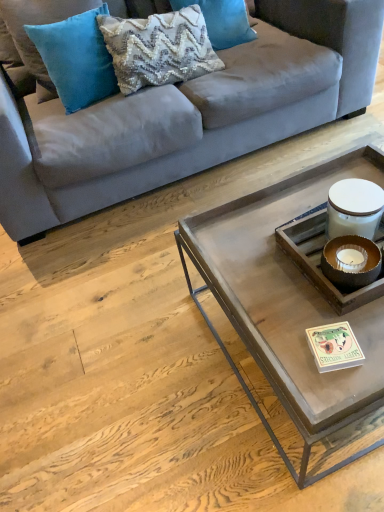
Where is `metallic gray tray at center`? The width and height of the screenshot is (384, 512). metallic gray tray at center is located at coordinates (288, 302).

What is the approximate width of woven fabric pillow at upper center, the 3th pillow viewed from the left?

12.46 inches.

The image size is (384, 512). What do you see at coordinates (159, 48) in the screenshot?
I see `textured cream pillow at upper center, the 2th pillow positioned from the left` at bounding box center [159, 48].

This screenshot has height=512, width=384. What do you see at coordinates (76, 59) in the screenshot? I see `teal velvet pillow at upper left, which is the 1th pillow from left to right` at bounding box center [76, 59].

Locate an element on the screen. The height and width of the screenshot is (512, 384). metallic gray tray at center is located at coordinates (288, 302).

You are a GUI agent. You are given a task and a screenshot of the screen. Output one action in this format:
    pyautogui.click(x=<x>, y=<y>)
    Task: Click on the coffee table below the suede gray couch at upper center (from a real-world perspective)
    This screenshot has width=384, height=512.
    Given the screenshot: What is the action you would take?
    pyautogui.click(x=288, y=302)

From the image's perspective, is suede gray couch at upper center on metallic gray tray at center?

Yes, from the image's perspective, suede gray couch at upper center is on top of metallic gray tray at center.

Is metallic gray tray at center inside suede gray couch at upper center?

No, metallic gray tray at center is located outside of suede gray couch at upper center.

Which of these two, metallic gray tray at center or teal velvet pillow at upper left, arranged as the 3th pillow when viewed from the right, stands shorter?

Standing shorter between the two is metallic gray tray at center.

Is metallic gray tray at center bigger or smaller than teal velvet pillow at upper left, arranged as the 3th pillow when viewed from the right?

Clearly, metallic gray tray at center is larger in size than teal velvet pillow at upper left, arranged as the 3th pillow when viewed from the right.

This screenshot has height=512, width=384. I want to click on coffee table on the right of teal velvet pillow at upper left, arranged as the 3th pillow when viewed from the right, so click(288, 302).

Are metallic gray tray at center and teal velvet pillow at upper left, which is the 1th pillow from left to right, located far from each other?

Yes, metallic gray tray at center is far from teal velvet pillow at upper left, which is the 1th pillow from left to right.

Is suede gray couch at upper center taller than woven fabric pillow at upper center, the first pillow in the right-to-left sequence?

Indeed, suede gray couch at upper center has a greater height compared to woven fabric pillow at upper center, the first pillow in the right-to-left sequence.

Is suede gray couch at upper center not close to woven fabric pillow at upper center, the first pillow in the right-to-left sequence?

No, suede gray couch at upper center is in close proximity to woven fabric pillow at upper center, the first pillow in the right-to-left sequence.

Does suede gray couch at upper center appear on the left side of woven fabric pillow at upper center, the 3th pillow viewed from the left?

Correct, you'll find suede gray couch at upper center to the left of woven fabric pillow at upper center, the 3th pillow viewed from the left.

In terms of height, does textured cream pillow at upper center, which is the second pillow from right to left, look taller or shorter compared to teal velvet pillow at upper left, which is the 1th pillow from left to right?

In the image, textured cream pillow at upper center, which is the second pillow from right to left, appears to be shorter than teal velvet pillow at upper left, which is the 1th pillow from left to right.

Are textured cream pillow at upper center, which is the second pillow from right to left, and teal velvet pillow at upper left, arranged as the 3th pillow when viewed from the right, beside each other?

textured cream pillow at upper center, which is the second pillow from right to left, is not next to teal velvet pillow at upper left, arranged as the 3th pillow when viewed from the right, and they're not touching.

At what (x,y) coordinates should I click in order to perform the action: click on the 1st pillow to the right when counting from the teal velvet pillow at upper left, arranged as the 3th pillow when viewed from the right. Please return your answer as a coordinate pair (x, y). Looking at the image, I should click on (159, 48).

Based on the photo, considering the relative sizes of textured cream pillow at upper center, which is the second pillow from right to left, and teal velvet pillow at upper left, which is the 1th pillow from left to right, in the image provided, is textured cream pillow at upper center, which is the second pillow from right to left, wider than teal velvet pillow at upper left, which is the 1th pillow from left to right,?

Yes, textured cream pillow at upper center, which is the second pillow from right to left, is wider than teal velvet pillow at upper left, which is the 1th pillow from left to right.

From a real-world perspective, which is physically above, metallic gray tray at center or suede gray couch at upper center?

From a 3D spatial view, suede gray couch at upper center is above.

Is metallic gray tray at center positioned behind suede gray couch at upper center?

No, metallic gray tray at center is closer to the camera.

Which object is positioned more to the left, metallic gray tray at center or suede gray couch at upper center?

suede gray couch at upper center.

Which object is positioned more to the right, woven fabric pillow at upper center, the 3th pillow viewed from the left, or textured cream pillow at upper center, the 2th pillow positioned from the left?

woven fabric pillow at upper center, the 3th pillow viewed from the left.

In terms of size, does woven fabric pillow at upper center, the 3th pillow viewed from the left, appear bigger or smaller than textured cream pillow at upper center, the 2th pillow positioned from the left?

woven fabric pillow at upper center, the 3th pillow viewed from the left, is smaller than textured cream pillow at upper center, the 2th pillow positioned from the left.

Based on the photo, is woven fabric pillow at upper center, the first pillow in the right-to-left sequence, oriented away from textured cream pillow at upper center, the 2th pillow positioned from the left?

woven fabric pillow at upper center, the first pillow in the right-to-left sequence, does not have its back to textured cream pillow at upper center, the 2th pillow positioned from the left.

From the image's perspective, which is above, woven fabric pillow at upper center, the 3th pillow viewed from the left, or textured cream pillow at upper center, the 2th pillow positioned from the left?

woven fabric pillow at upper center, the 3th pillow viewed from the left, is shown above in the image.

Could you tell me if teal velvet pillow at upper left, which is the 1th pillow from left to right, is turned towards textured cream pillow at upper center, the 2th pillow positioned from the left?

No, teal velvet pillow at upper left, which is the 1th pillow from left to right, is not turned towards textured cream pillow at upper center, the 2th pillow positioned from the left.

From the image's perspective, is teal velvet pillow at upper left, arranged as the 3th pillow when viewed from the right, above or below textured cream pillow at upper center, which is the second pillow from right to left?

teal velvet pillow at upper left, arranged as the 3th pillow when viewed from the right, is situated higher than textured cream pillow at upper center, which is the second pillow from right to left, in the image.

Is textured cream pillow at upper center, which is the second pillow from right to left, a part of teal velvet pillow at upper left, which is the 1th pillow from left to right?

No, textured cream pillow at upper center, which is the second pillow from right to left, is located outside of teal velvet pillow at upper left, which is the 1th pillow from left to right.

You are a GUI agent. You are given a task and a screenshot of the screen. Output one action in this format:
    pyautogui.click(x=<x>, y=<y>)
    Task: Click on the coffee table below the suede gray couch at upper center (from the image's perspective)
    This screenshot has width=384, height=512.
    Given the screenshot: What is the action you would take?
    pyautogui.click(x=288, y=302)

Locate an element on the screen. The height and width of the screenshot is (512, 384). coffee table on the right of teal velvet pillow at upper left, which is the 1th pillow from left to right is located at coordinates (288, 302).

Looking at the image, which one is located closer to teal velvet pillow at upper left, which is the 1th pillow from left to right, textured cream pillow at upper center, which is the second pillow from right to left, or metallic gray tray at center?

textured cream pillow at upper center, which is the second pillow from right to left, is positioned closer to the anchor teal velvet pillow at upper left, which is the 1th pillow from left to right.

When comparing their distances from woven fabric pillow at upper center, the 3th pillow viewed from the left, does metallic gray tray at center or textured cream pillow at upper center, which is the second pillow from right to left, seem closer?

textured cream pillow at upper center, which is the second pillow from right to left.

Which object lies further to the anchor point metallic gray tray at center, textured cream pillow at upper center, the 2th pillow positioned from the left, or suede gray couch at upper center?

The object further to metallic gray tray at center is textured cream pillow at upper center, the 2th pillow positioned from the left.

Estimate the real-world distances between objects in this image. Which object is further from teal velvet pillow at upper left, arranged as the 3th pillow when viewed from the right, metallic gray tray at center or woven fabric pillow at upper center, the 3th pillow viewed from the left?

The object further to teal velvet pillow at upper left, arranged as the 3th pillow when viewed from the right, is metallic gray tray at center.

Which object lies further to the anchor point metallic gray tray at center, suede gray couch at upper center or teal velvet pillow at upper left, arranged as the 3th pillow when viewed from the right?

The object further to metallic gray tray at center is teal velvet pillow at upper left, arranged as the 3th pillow when viewed from the right.

Considering their positions, is woven fabric pillow at upper center, the first pillow in the right-to-left sequence, positioned further to textured cream pillow at upper center, the 2th pillow positioned from the left, than suede gray couch at upper center?

suede gray couch at upper center is further to textured cream pillow at upper center, the 2th pillow positioned from the left.

Based on their spatial positions, is textured cream pillow at upper center, which is the second pillow from right to left, or woven fabric pillow at upper center, the 3th pillow viewed from the left, further from suede gray couch at upper center?

Among the two, woven fabric pillow at upper center, the 3th pillow viewed from the left, is located further to suede gray couch at upper center.

Which object lies nearer to the anchor point metallic gray tray at center, teal velvet pillow at upper left, arranged as the 3th pillow when viewed from the right, or textured cream pillow at upper center, which is the second pillow from right to left?

textured cream pillow at upper center, which is the second pillow from right to left.

At what (x,y) coordinates should I click in order to perform the action: click on pillow between suede gray couch at upper center and metallic gray tray at center in the up-down direction. Please return your answer as a coordinate pair (x, y). The height and width of the screenshot is (512, 384). Looking at the image, I should click on (159, 48).

This screenshot has height=512, width=384. In order to click on studio couch that lies between woven fabric pillow at upper center, the first pillow in the right-to-left sequence, and metallic gray tray at center from top to bottom in this screenshot , I will do `click(187, 115)`.

This screenshot has height=512, width=384. I want to click on pillow between teal velvet pillow at upper left, arranged as the 3th pillow when viewed from the right, and metallic gray tray at center from top to bottom, so click(159, 48).

Where is `pillow situated between teal velvet pillow at upper left, arranged as the 3th pillow when viewed from the right, and woven fabric pillow at upper center, the first pillow in the right-to-left sequence, from left to right`? This screenshot has width=384, height=512. pillow situated between teal velvet pillow at upper left, arranged as the 3th pillow when viewed from the right, and woven fabric pillow at upper center, the first pillow in the right-to-left sequence, from left to right is located at coordinates (159, 48).